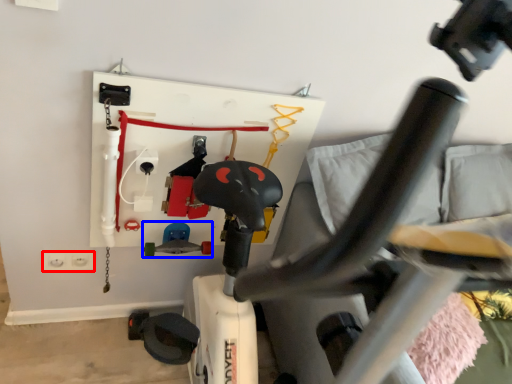
Question: Which point is further to the camera, electric outlet (highlighted by a red box) or toy (highlighted by a blue box)?

Choices:
 (A) electric outlet
 (B) toy

Answer: (A)